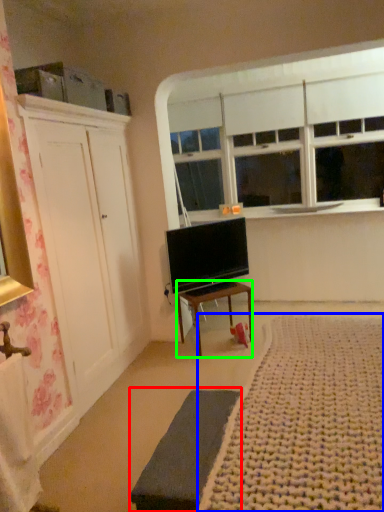
Question: Considering the real-world distances, which object is farthest from bed frame (highlighted by a red box)? plain (highlighted by a blue box) or desk (highlighted by a green box)?

Choices:
 (A) plain
 (B) desk

Answer: (B)